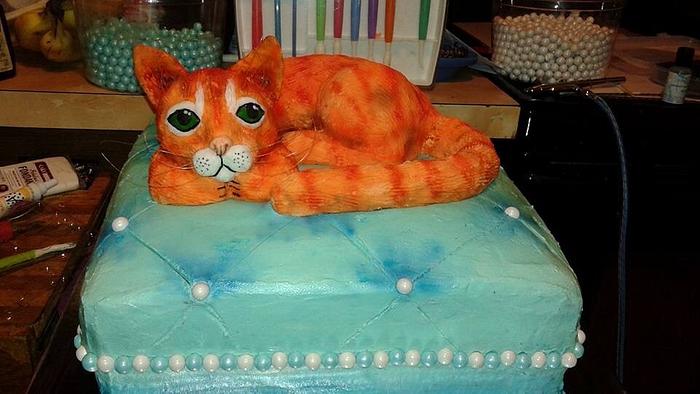
Identify the location of cushion. The image size is (700, 394). (544, 307).